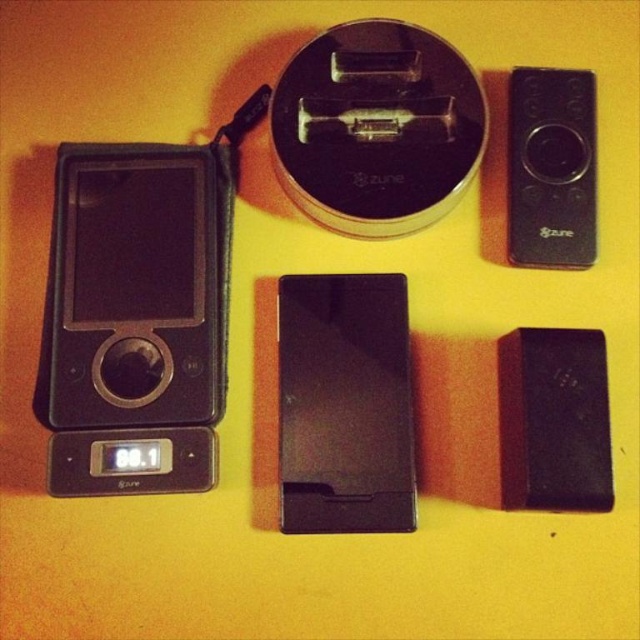
Who is positioned more to the right, matte black ipod at left or black matte ipod at center?

Positioned to the right is black matte ipod at center.

Consider the image. Is matte black ipod at left in front of black matte ipod at center?

No, matte black ipod at left is behind black matte ipod at center.

Is point (138, 417) closer to camera compared to point (349, 360)?

Yes.

Locate an element on the screen. The image size is (640, 640). matte black ipod at left is located at coordinates (138, 285).

Is point (305, 365) behind point (577, 99)?

No, it is not.

The width and height of the screenshot is (640, 640). What are the coordinates of `black matte ipod at center` in the screenshot? It's located at (344, 404).

Is matte black ipod at left below black matte remote control at upper right?

Yes, matte black ipod at left is below black matte remote control at upper right.

Is point (180, 147) less distant than point (577, 241)?

No, (180, 147) is further to viewer.

Describe the element at coordinates (138, 285) in the screenshot. I see `matte black ipod at left` at that location.

The image size is (640, 640). Find the location of `matte black ipod at left`. matte black ipod at left is located at coordinates click(x=138, y=285).